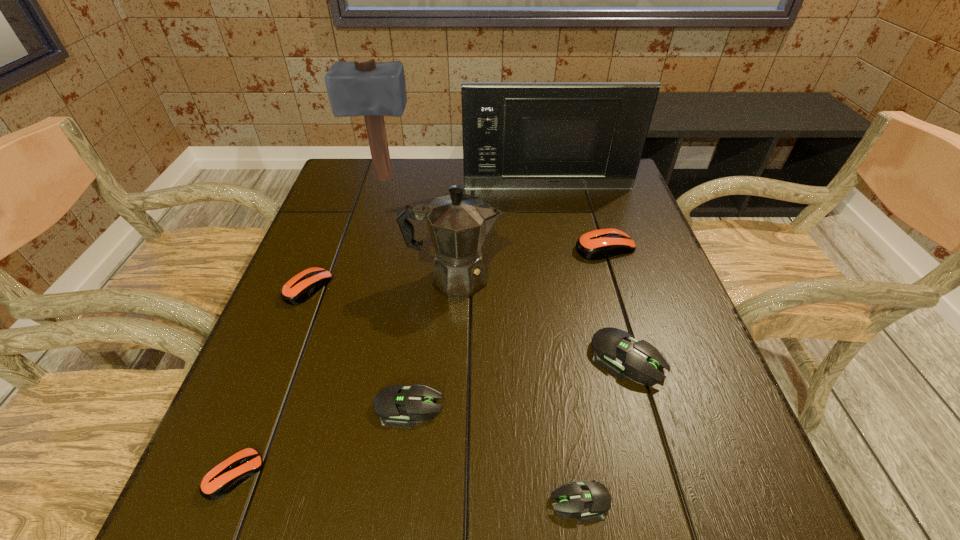
Identify the location of blank region between the fourth computer mouse from left to right and the leftmost gray computer mouse. (494, 454).

Find the location of a particular element. free spot between the farthest computer mouse and the biggest gray computer mouse is located at coordinates (615, 303).

You are a GUI agent. You are given a task and a screenshot of the screen. Output one action in this format:
    pyautogui.click(x=<x>, y=<y>)
    Task: Click on the free space between the seventh shortest object and the leftmost gray computer mouse
    The height and width of the screenshot is (540, 960).
    Given the screenshot: What is the action you would take?
    pyautogui.click(x=431, y=342)

At what (x,y) coordinates should I click in order to perform the action: click on free spot between the biggest gray computer mouse and the second biggest gray computer mouse. Please return your answer as a coordinate pair (x, y). The width and height of the screenshot is (960, 540). Looking at the image, I should click on coord(517,383).

Find the location of `empty space between the brown mallet and the nearest orange computer mouse`. empty space between the brown mallet and the nearest orange computer mouse is located at coordinates (309, 326).

Identify the location of the second closest object to the biggest gray computer mouse. The width and height of the screenshot is (960, 540). (458, 223).

Select which object is the third closest to the fourth computer mouse from right to left. Please provide its 2D coordinates. Your answer should be formatted as a tuple, i.e. [(x, y)], where the tuple contains the x and y coordinates of a point satisfying the conditions above.

[(458, 223)]

Find the location of a particular element. The image size is (960, 540). the fourth closest computer mouse to the leftmost gray computer mouse is located at coordinates (615, 350).

Select which computer mouse appears as the fifth closest to the biggest gray computer mouse. Please provide its 2D coordinates. Your answer should be formatted as a tuple, i.e. [(x, y)], where the tuple contains the x and y coordinates of a point satisfying the conditions above.

[(224, 477)]

Locate which orange computer mouse is the second closest to the biggest gray computer mouse. Please provide its 2D coordinates. Your answer should be formatted as a tuple, i.e. [(x, y)], where the tuple contains the x and y coordinates of a point satisfying the conditions above.

[(301, 287)]